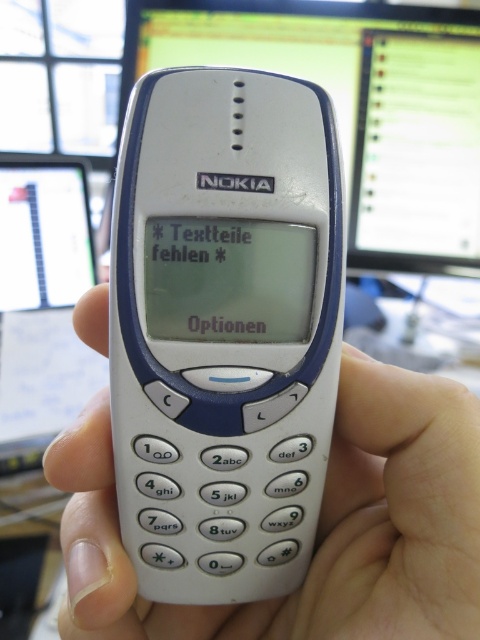
You are organizing a desk and need to place the white plastic nokia phone at center and the matte plastic computer screen at upper center. Which object takes up more desk space?

The matte plastic computer screen at upper center takes up more desk space than the white plastic nokia phone at center because the white plastic nokia phone at center occupies less space.

You are trying to determine if the white plastic nokia phone at center can fit into a phone case designed for the white plastic phone at center. Based on the scene description, would the case be suitable for the nokia phone?

The white plastic nokia phone at center is thinner than the white plastic phone at center, so the case designed for the white plastic phone at center may not fit properly as the nokia phone is thinner.

You are holding a Nokia 3310 phone and want to reach the point at coordinates point (471, 508) on the screen. If your finger is 1 inch wide, can you comfortably touch that point without accidentally touching other areas?

The distance between point (471, 508) and the viewer is 14.90 inches. Since your finger is 1 inch wide, you can comfortably touch the point without accidentally touching other areas as there is sufficient space.